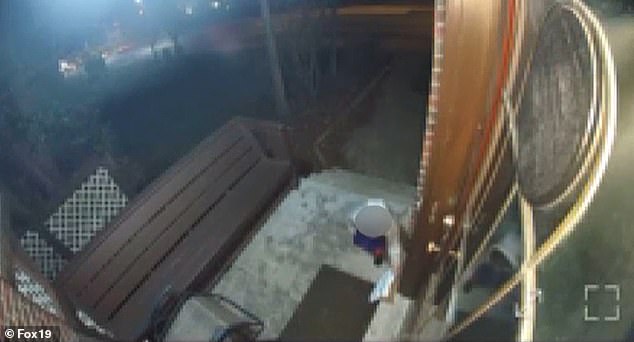
What are the coordinates of `door handle` in the screenshot? It's located at (432, 247).